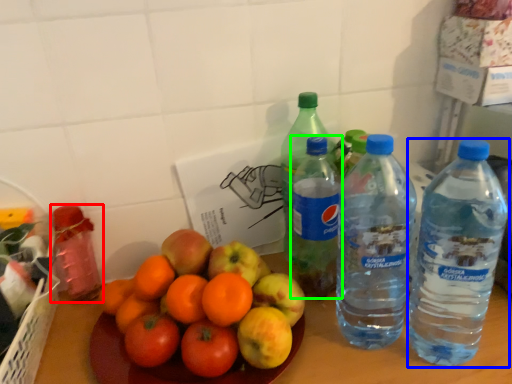
Question: Estimate the real-world distances between objects in this image. Which object is closer to bottle (highlighted by a red box), bottle (highlighted by a blue box) or bottle (highlighted by a green box)?

Choices:
 (A) bottle
 (B) bottle

Answer: (B)